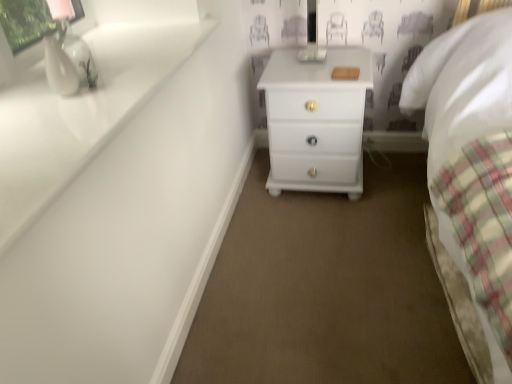
Where is `free space to the left of white glossy vase at upper left`? free space to the left of white glossy vase at upper left is located at coordinates (28, 93).